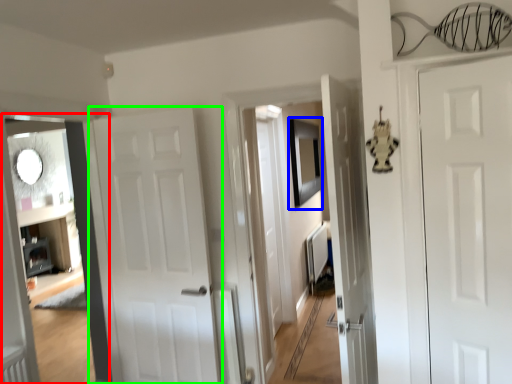
Question: Considering the real-world distances, which object is farthest from corridor (highlighted by a red box)? picture frame (highlighted by a blue box) or door (highlighted by a green box)?

Choices:
 (A) picture frame
 (B) door

Answer: (A)